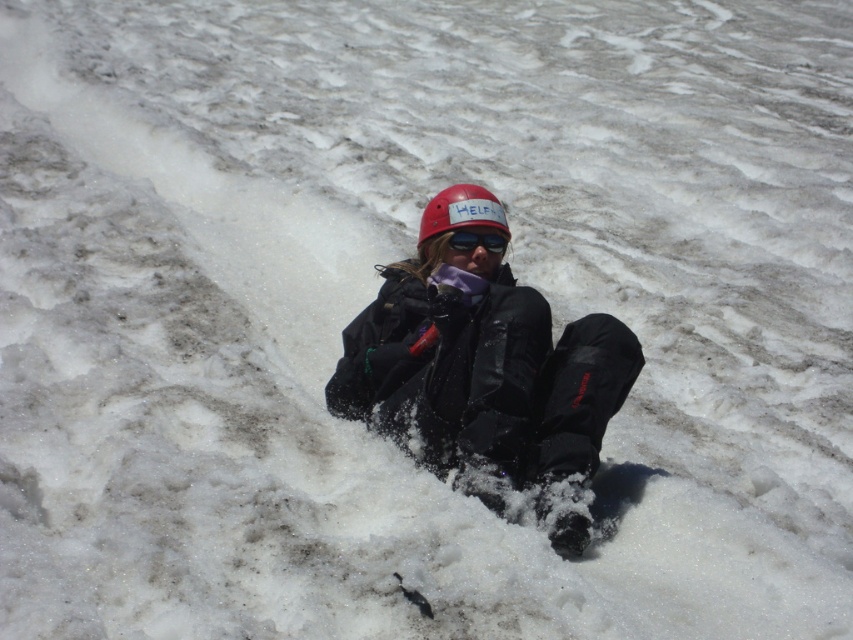
Locate an element on the screen. This screenshot has height=640, width=853. matte black jacket at center is located at coordinates (486, 371).

Does matte black jacket at center have a greater width compared to black reflective sunglasses at center?

Correct, the width of matte black jacket at center exceeds that of black reflective sunglasses at center.

Identify the location of matte black jacket at center. (486, 371).

This screenshot has height=640, width=853. I want to click on matte black jacket at center, so (x=486, y=371).

Between matte red helmet at center and black reflective sunglasses at center, which one is positioned lower?

black reflective sunglasses at center is lower down.

Based on the photo, measure the distance from matte red helmet at center to black reflective sunglasses at center.

matte red helmet at center is 2.12 inches away from black reflective sunglasses at center.

What do you see at coordinates (461, 211) in the screenshot? I see `matte red helmet at center` at bounding box center [461, 211].

Identify the location of matte red helmet at center. (461, 211).

This screenshot has width=853, height=640. What do you see at coordinates (486, 371) in the screenshot? I see `matte black jacket at center` at bounding box center [486, 371].

Is point (628, 332) more distant than point (447, 227)?

No, (628, 332) is closer to viewer.

Is point (631, 340) farther from camera compared to point (479, 200)?

No.

At what (x,y) coordinates should I click in order to perform the action: click on matte black jacket at center. Please return your answer as a coordinate pair (x, y). This screenshot has height=640, width=853. Looking at the image, I should click on (486, 371).